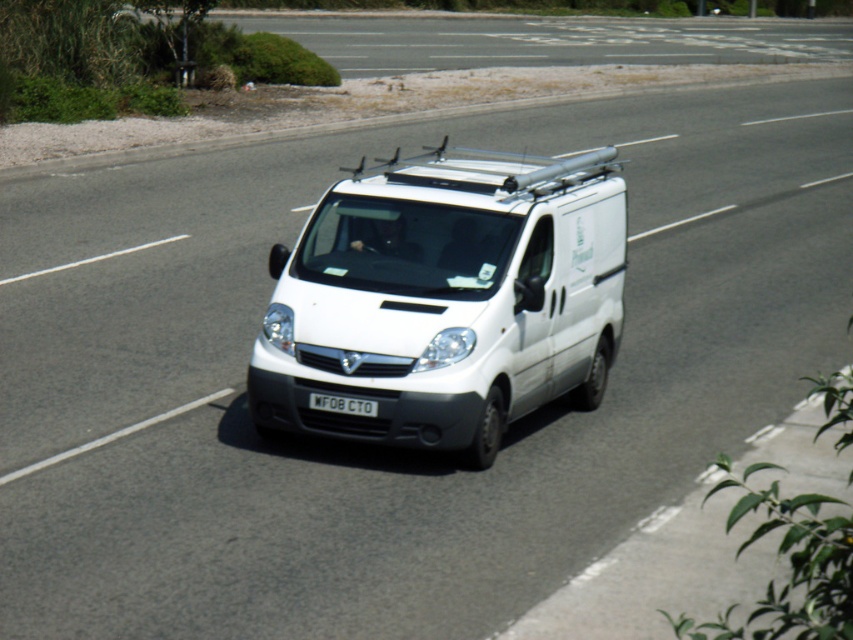
Question: Which point appears farthest from the camera in this image?

Choices:
 (A) (576, 161)
 (B) (367, 401)

Answer: (A)

Question: Does white matte van at center appear over black plastic license plate at center?

Choices:
 (A) no
 (B) yes

Answer: (B)

Question: Is white matte van at center thinner than black plastic license plate at center?

Choices:
 (A) yes
 (B) no

Answer: (B)

Question: Is white matte van at center positioned in front of black plastic license plate at center?

Choices:
 (A) no
 (B) yes

Answer: (B)